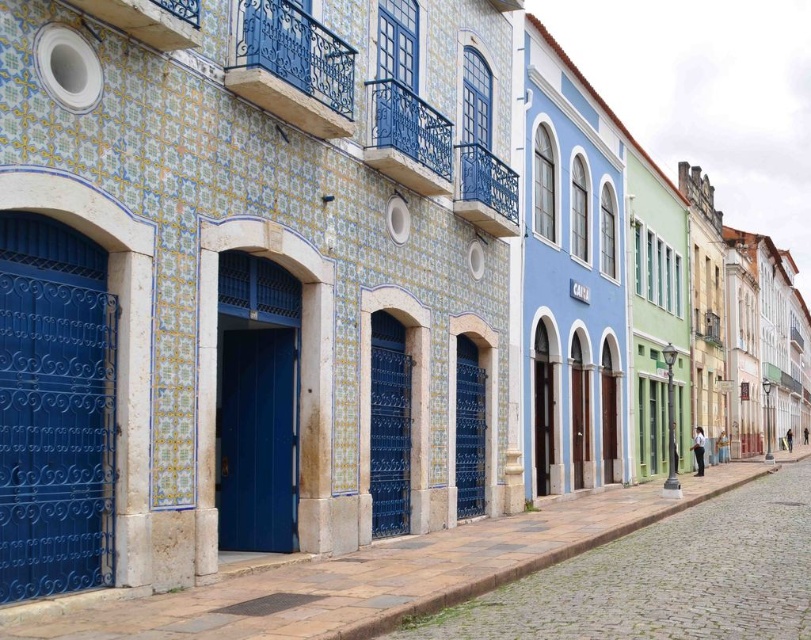
You are a delivery person trying to choose between two gates to enter the street. The matte blue gate at left and the matte blue gate at center are both options. Which gate has a wider opening for your delivery van?

The matte blue gate at left has a larger width than the matte blue gate at center, so it would provide a wider opening for your delivery van.

You are a tourist standing on the street and see the two matte blue gates. Which gate is located higher up, the matte blue gate at left or the matte blue gate at center?

The matte blue gate at left is positioned over the matte blue gate at center, so it is higher up.